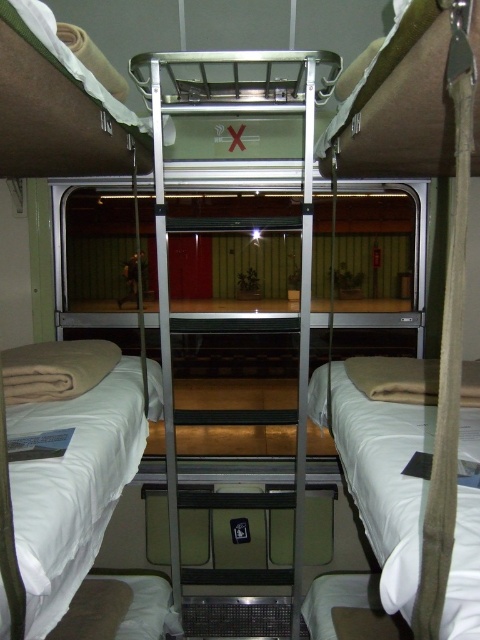
You are a traveler trying to store your backpack in the sleeping car compartment. The metallic silver bunk bed at center and the white soft pillow at lower left are in your way. Can you fit your backpack between them if it measures 18 inches in width?

The metallic silver bunk bed at center is 19.92 inches away from the white soft pillow at lower left. Since your backpack is 18 inches wide, it can fit between them as the space is slightly larger than the backpack.

You are a traveler who just entered the train compartment and wants to sleep on the lower bunk. You see the white soft bedding at lower left and the white soft pillow at lower left. Which one is higher in height?

The white soft bedding at lower left is taller than the white soft pillow at lower left.

You are a passenger in the train compartment and want to place your backpack on the metallic silver bunk bed at center. However, there is a white soft pillow at lower left. Which object is closer to the ladder for easier access?

The metallic silver bunk bed at center is closer to the ladder than the white soft pillow at lower left, so placing the backpack there would be more accessible.